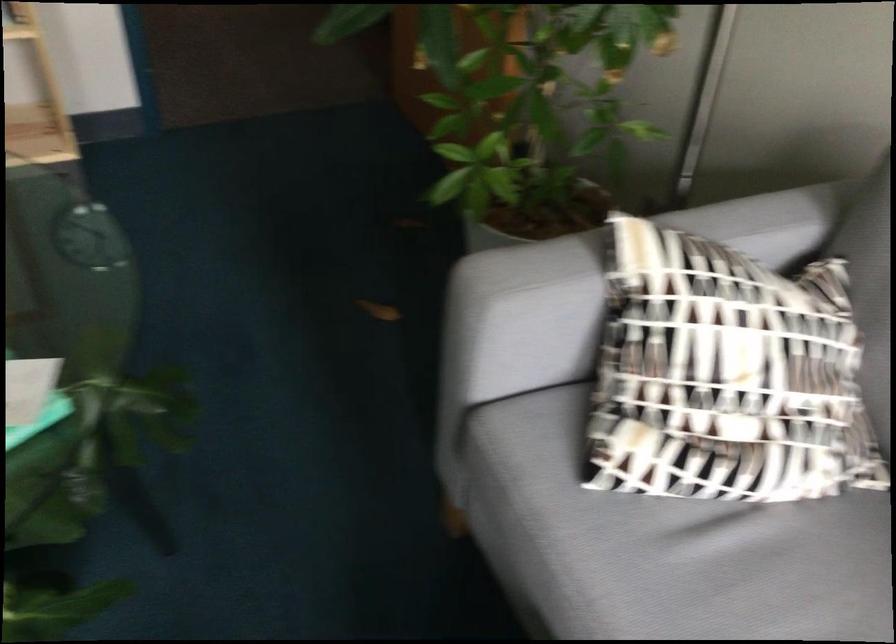
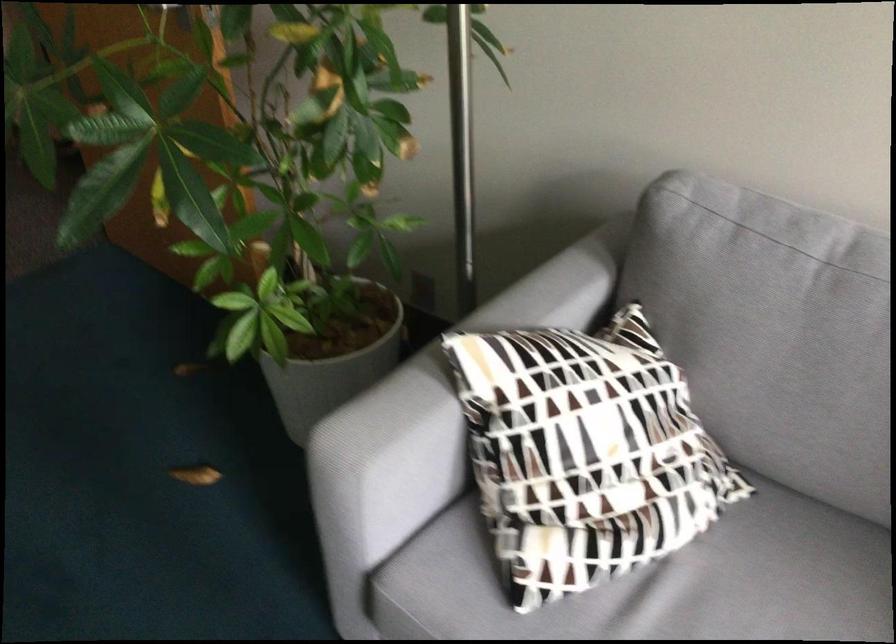
Find the pixel in the second image that matches [528,228] in the first image.

(332, 355)